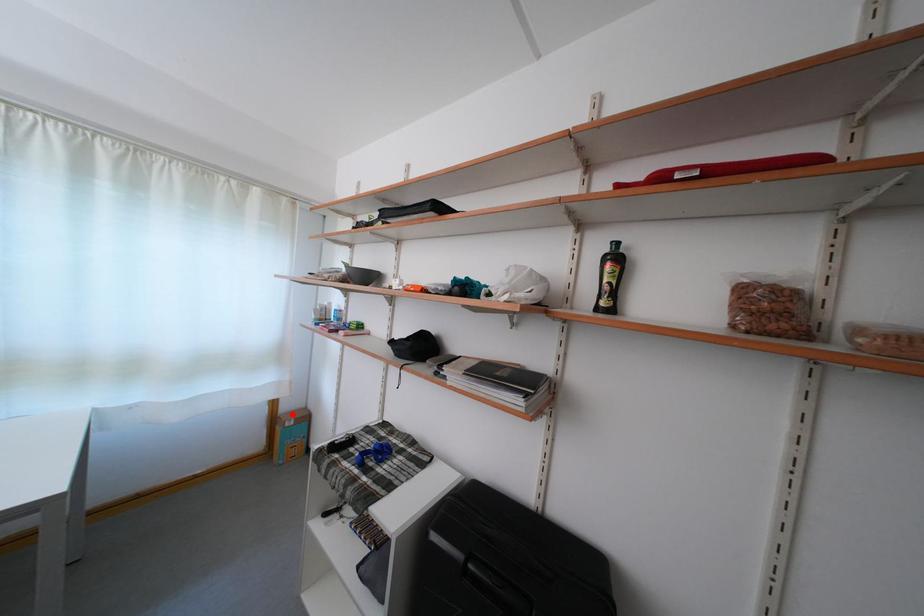
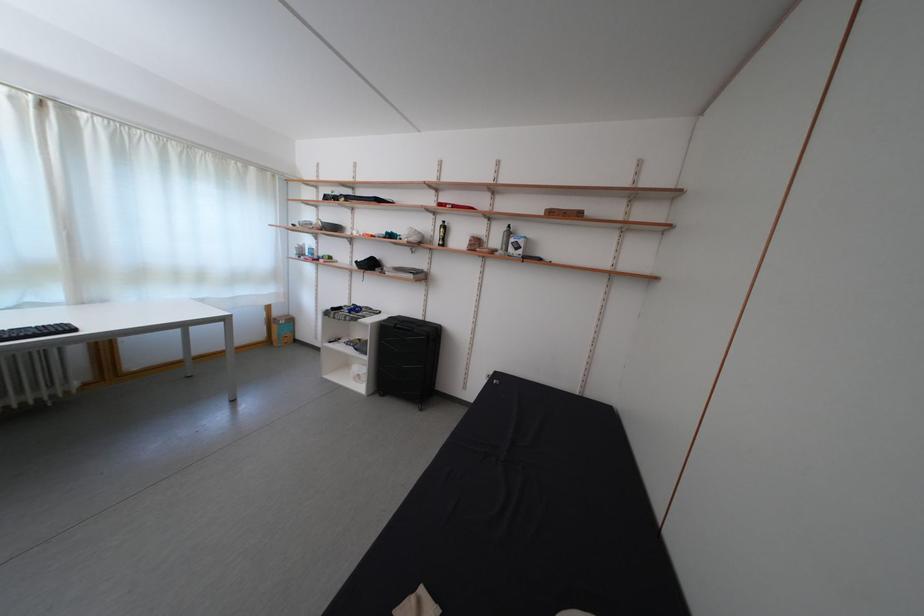
Where in the second image is the point corresponding to the highlighted location from the first image?

(285, 320)